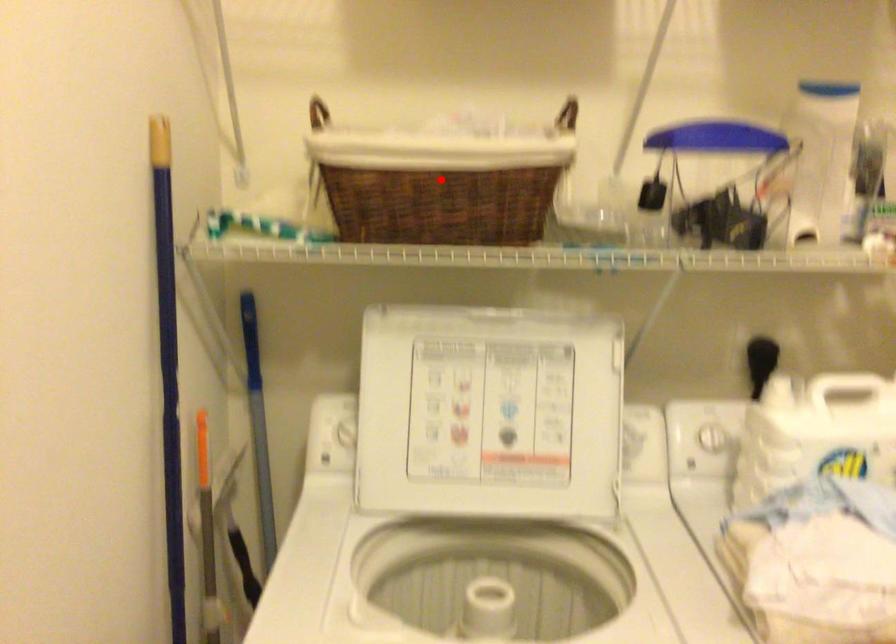
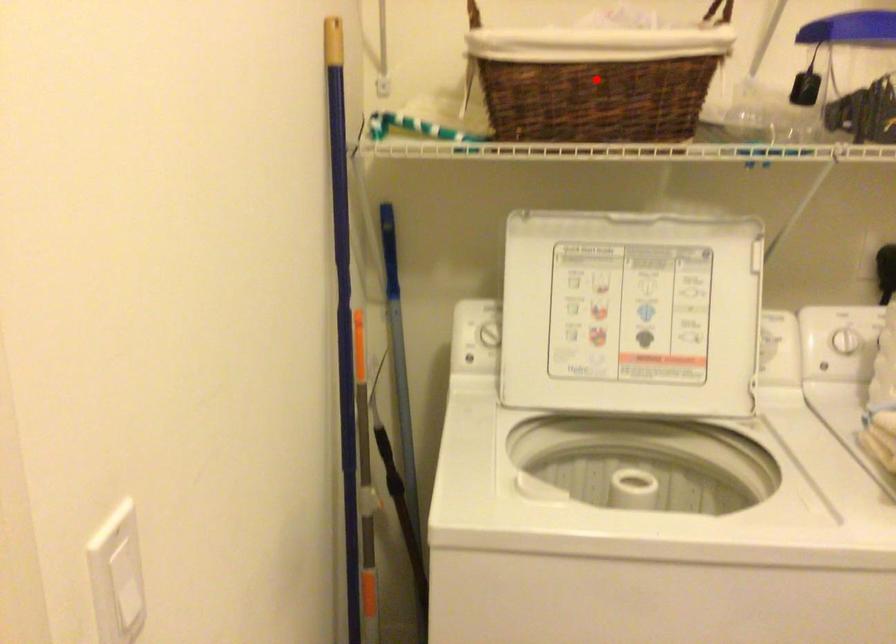
I am providing you with two images of the same scene from different viewpoints. A red point is marked on the first image and another point is marked on the second image. Are the points marked in image1 and image2 representing the same 3D position?

Yes